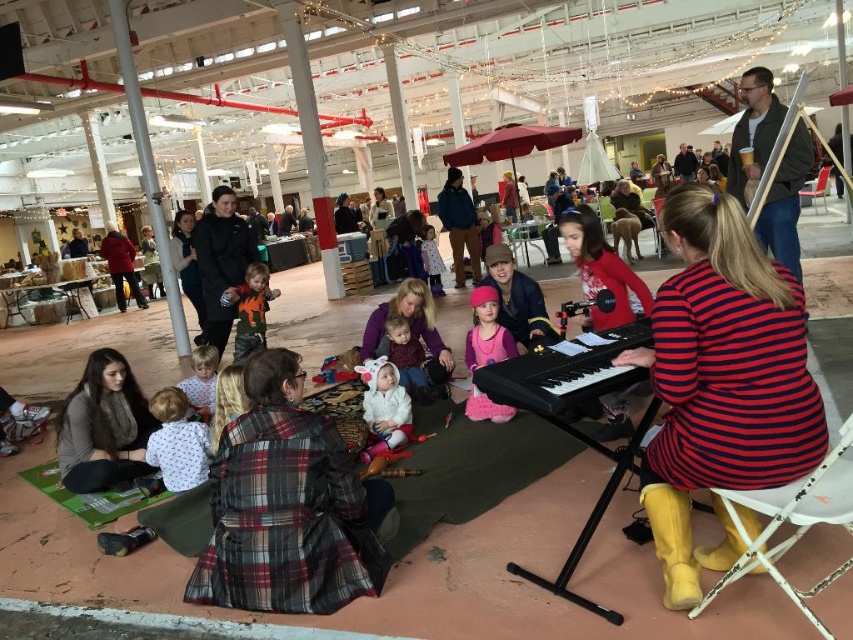
You are a photographer trying to capture a photo of the plaid fabric at center and the pink fuzzy boots at center. Since you want to emphasize the size difference between them, which object should you position closer to the camera to achieve this effect?

To emphasize the size difference between the plaid fabric at center and the pink fuzzy boots at center, you should position the plaid fabric at center closer to the camera because it is bigger than the pink fuzzy boots at center.